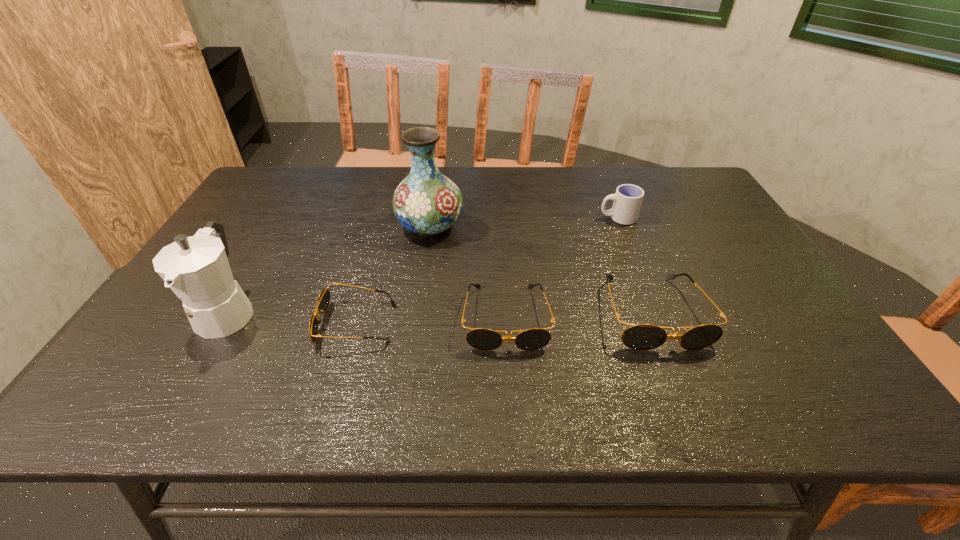
Find the location of a particular element. This screenshot has height=540, width=960. vacant space positioned 0.080m on the front-facing side of the leftmost sunglasses is located at coordinates (284, 323).

Identify the location of free space located 0.310m on the front-facing side of the leftmost sunglasses. This screenshot has width=960, height=540. (186, 323).

In order to click on vacant area located 0.330m on the right of the vase in this screenshot , I will do `click(573, 226)`.

The image size is (960, 540). What are the coordinates of `free space located with the handle on the side of the cup` in the screenshot? It's located at (498, 218).

This screenshot has height=540, width=960. In order to click on vacant space situated 0.230m with the handle on the side of the cup in this screenshot , I will do `click(524, 218)`.

Image resolution: width=960 pixels, height=540 pixels. What are the coordinates of `free space located 0.390m with the handle on the side of the cup` in the screenshot? It's located at (472, 218).

Locate an element on the screen. Image resolution: width=960 pixels, height=540 pixels. coffeepot present at the near edge is located at coordinates (196, 268).

Where is `object located at the left edge`? object located at the left edge is located at coordinates (196, 268).

Locate an element on the screen. This screenshot has width=960, height=540. object located at the near left corner is located at coordinates (196, 268).

Image resolution: width=960 pixels, height=540 pixels. In the image, there is a desktop. Identify the location of vacant space at the far edge. (349, 185).